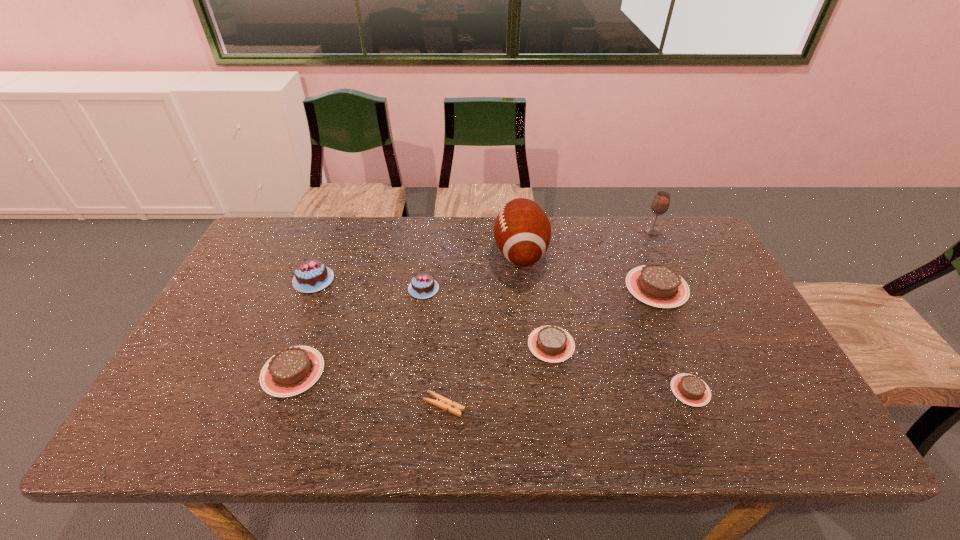
Locate an element on the screen. free location that satisfies the following two spatial constraints: 1. on the back side of the shortest object; 2. on the left side of the farthest brown chocolate cake is located at coordinates (452, 287).